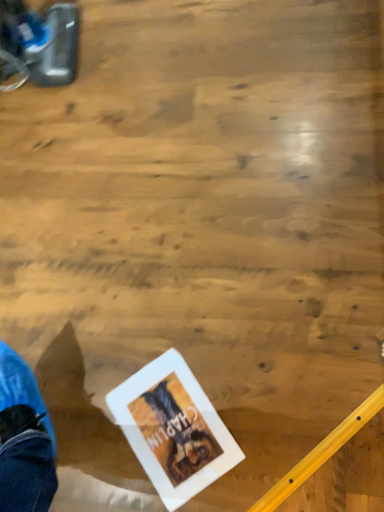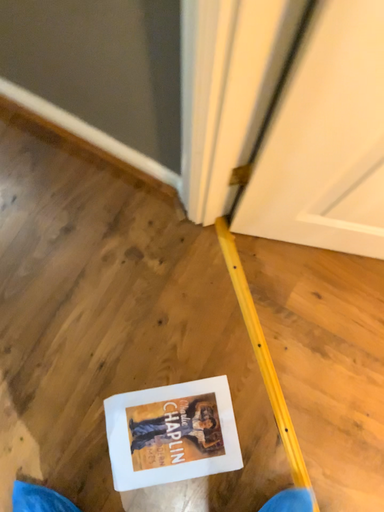
Question: Which way did the camera rotate in the video?

Choices:
 (A) rotated left
 (B) rotated right

Answer: (B)